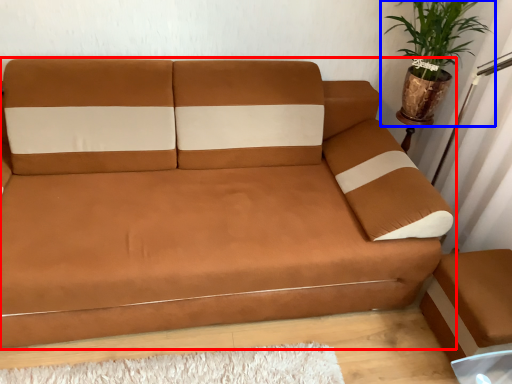
Question: Which of the following is the farthest to the observer, studio couch (highlighted by a red box) or houseplant (highlighted by a blue box)?

Choices:
 (A) studio couch
 (B) houseplant

Answer: (B)